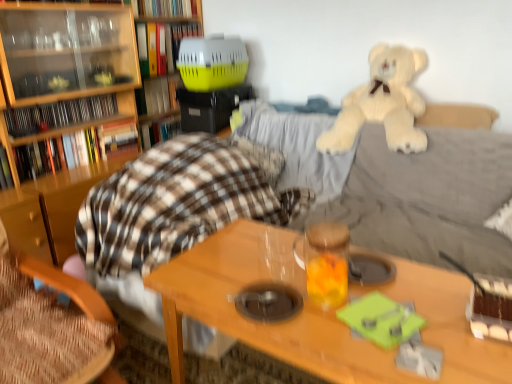
You are a GUI agent. You are given a task and a screenshot of the screen. Output one action in this format:
    pyautogui.click(x=<x>, y=<y>)
    Task: Click on the free space above hardcover book at left, which is the second book in bottom-to-top order (from a real-world perspective)
    The height and width of the screenshot is (384, 512).
    Given the screenshot: What is the action you would take?
    pyautogui.click(x=71, y=128)